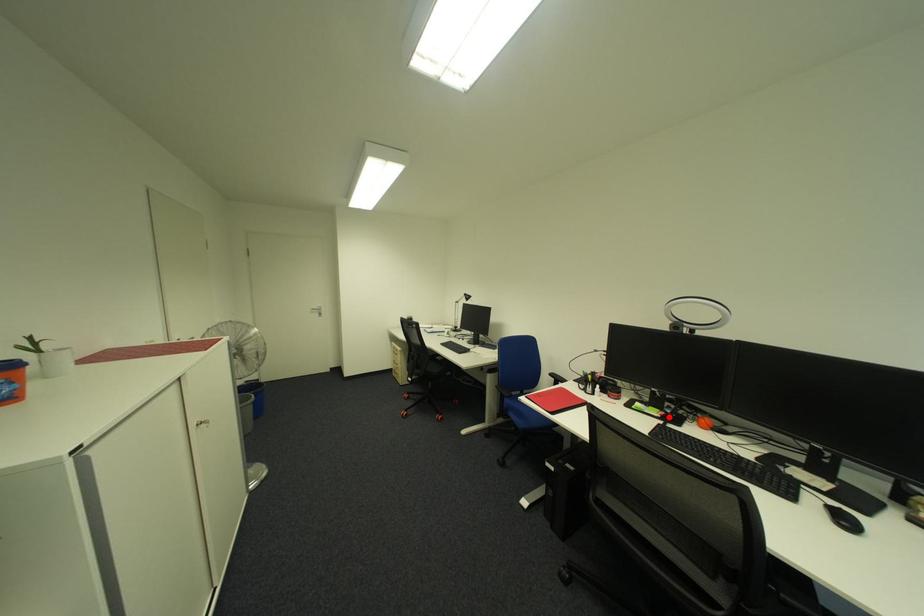
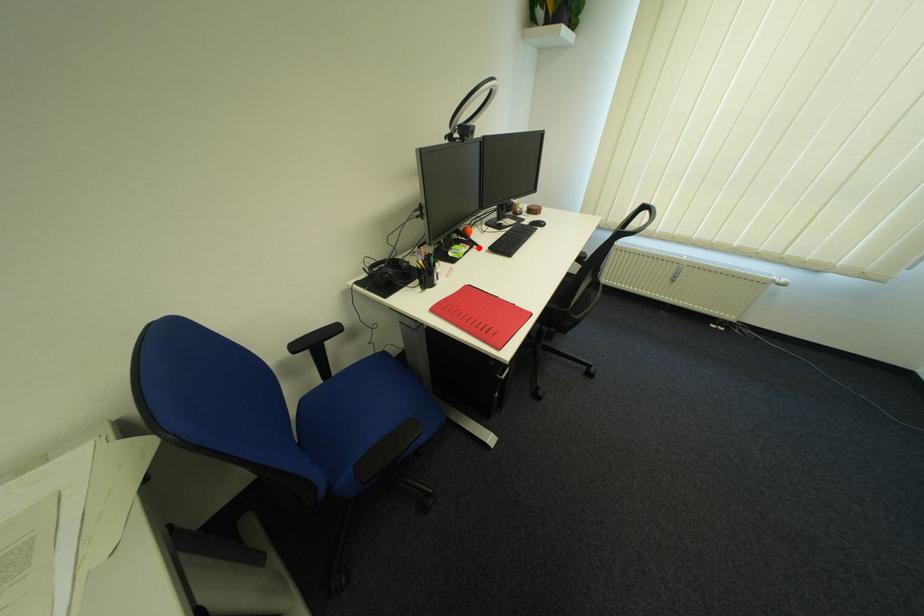
I am providing you with two images of the same scene from different viewpoints. A red point is marked on the first image and another point is marked on the second image. Is the red point in image1 aligned with the point shown in image2?

Yes